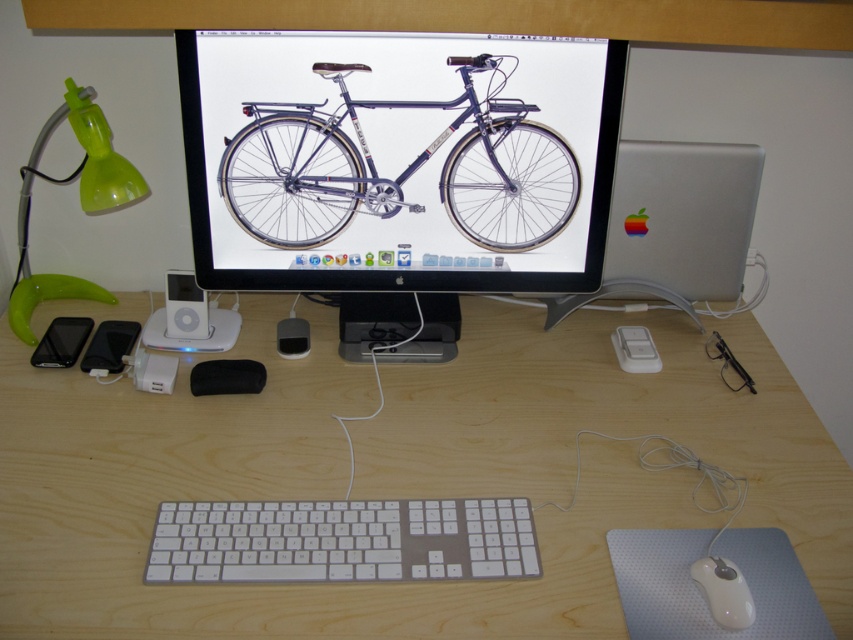
Question: Among these points, which one is nearest to the camera?

Choices:
 (A) (305, 332)
 (B) (144, 195)

Answer: (B)

Question: Can you confirm if matte black phone at lower left is smaller than satin black ipod at center?

Choices:
 (A) yes
 (B) no

Answer: (B)

Question: Is white glossy ipod at center to the left of satin black ipod at center from the viewer's perspective?

Choices:
 (A) yes
 (B) no

Answer: (A)

Question: Which object is positioned closest to the metallic blue bicycle at center?

Choices:
 (A) white plastic keyboard at center
 (B) matte black phone at lower left

Answer: (A)

Question: Which point is closer to the camera taking this photo?

Choices:
 (A) (93, 346)
 (B) (73, 348)

Answer: (B)

Question: Is white plastic mouse at lower right smaller than black matte phone at lower left?

Choices:
 (A) no
 (B) yes

Answer: (B)